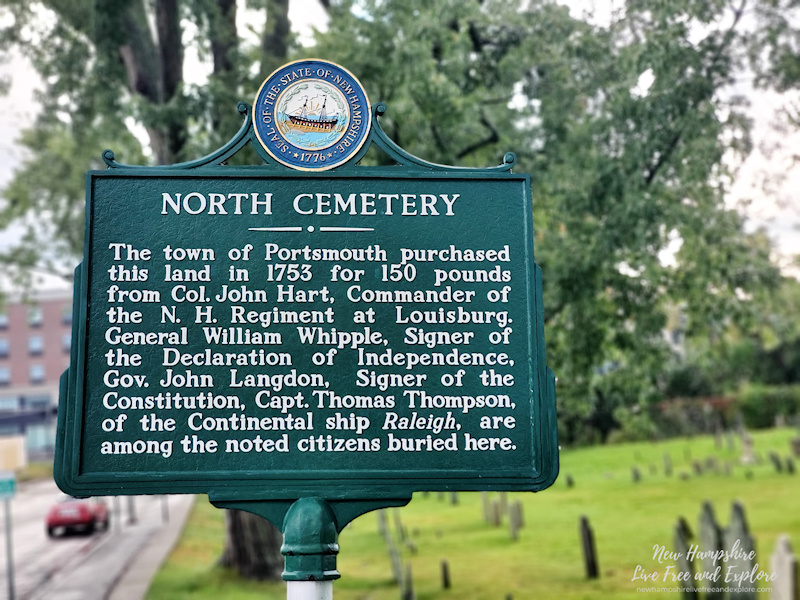
This screenshot has width=800, height=600. I want to click on plaque, so click(482, 213).